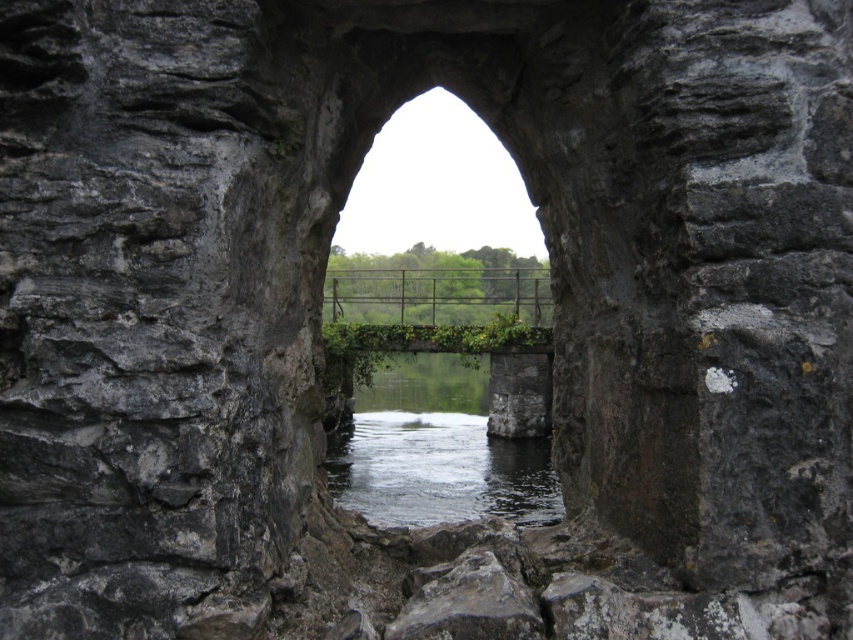
You are standing in front of the stone archway and see two points marked in the scene. Which point, point (372, 408) or point (355, 307), is closer to you?

Point (372, 408) is closer to the viewer than point (355, 307).

You are standing at the entrance of the stone archway and want to cross to the other side. The clear water at center flows beneath the metallic wire bridge at center. Which path should you choose to avoid getting wet?

You should choose the metallic wire bridge at center because the clear water at center occupies less space and is likely the flowing stream beneath it, making the bridge the dry path.